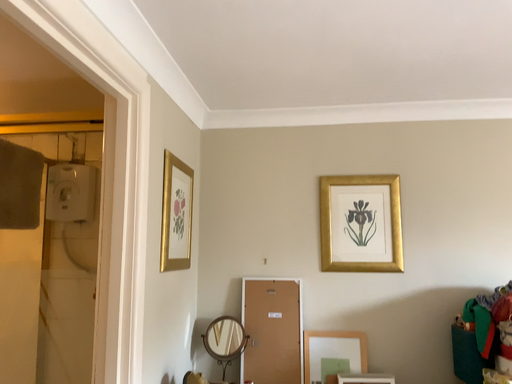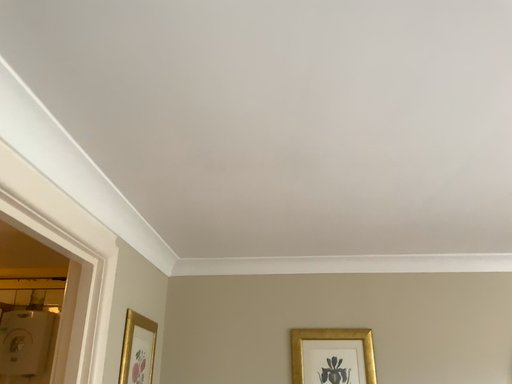
Question: How did the camera likely rotate when shooting the video?

Choices:
 (A) rotated upward
 (B) rotated downward

Answer: (A)